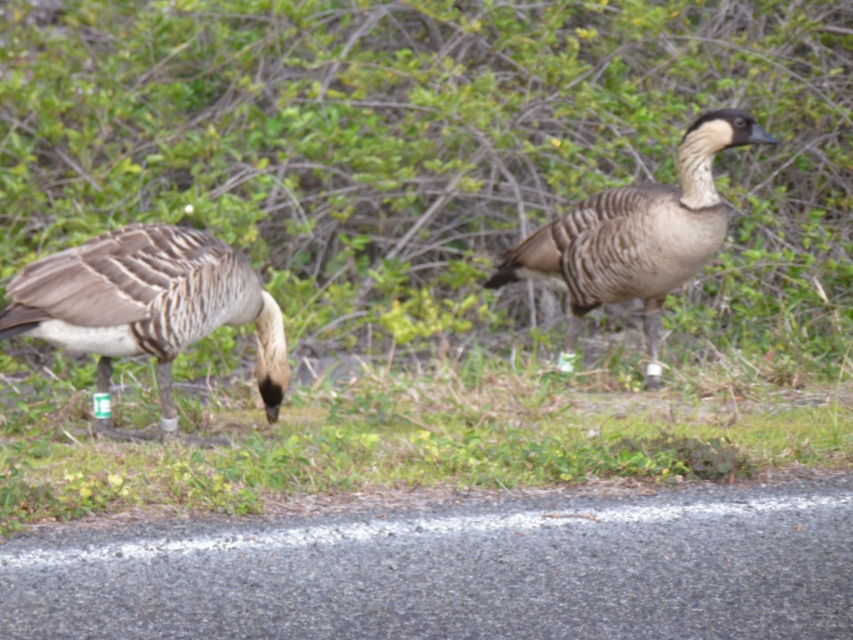
Between brown feathered goose at left and brown speckled goose at center, which one has less height?

brown feathered goose at left is shorter.

At what (x,y) coordinates should I click in order to perform the action: click on brown feathered goose at left. Please return your answer as a coordinate pair (x, y). The image size is (853, 640). Looking at the image, I should click on (148, 304).

Between green grass at lower center and brown feathered goose at left, which one appears on the left side from the viewer's perspective?

brown feathered goose at left

The width and height of the screenshot is (853, 640). I want to click on green grass at lower center, so click(x=428, y=435).

The image size is (853, 640). I want to click on green grass at lower center, so click(428, 435).

Can you confirm if green grass at lower center is bigger than brown speckled goose at center?

Yes, green grass at lower center is bigger than brown speckled goose at center.

Does green grass at lower center have a greater width compared to brown speckled goose at center?

Correct, the width of green grass at lower center exceeds that of brown speckled goose at center.

Where is `green grass at lower center`? Image resolution: width=853 pixels, height=640 pixels. green grass at lower center is located at coordinates (428, 435).